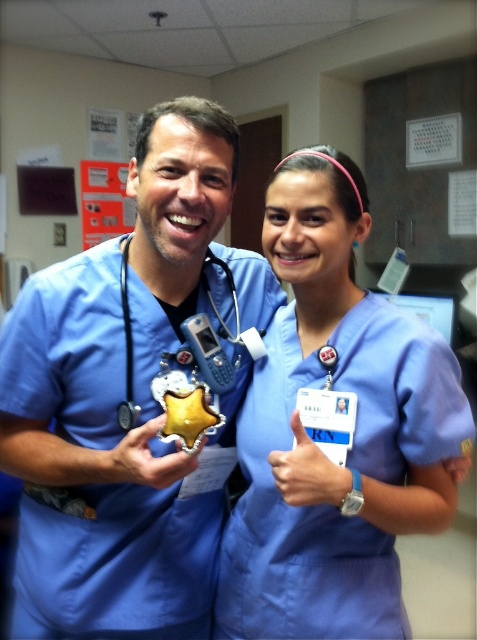
Question: In this image, where is matte blue scrubs at center located relative to blue fabric hand at center?

Choices:
 (A) above
 (B) below

Answer: (A)

Question: Considering the real-world distances, which object is farthest from the matte blue scrubs at center?

Choices:
 (A) matte blue stethoscope at left
 (B) gold metallic badge at center

Answer: (B)

Question: Does matte blue stethoscope at left have a greater width compared to blue fabric hand at center?

Choices:
 (A) yes
 (B) no

Answer: (A)

Question: Which of the following is the closest to the observer?

Choices:
 (A) (138, 464)
 (B) (100, 248)

Answer: (A)

Question: Estimate the real-world distances between objects in this image. Which object is closer to the blue scrubs at center?

Choices:
 (A) matte blue scrubs at center
 (B) blue fabric hand at center
 (C) gold metallic badge at center

Answer: (A)

Question: Is matte blue scrubs at center thinner than blue fabric hand at center?

Choices:
 (A) no
 (B) yes

Answer: (A)